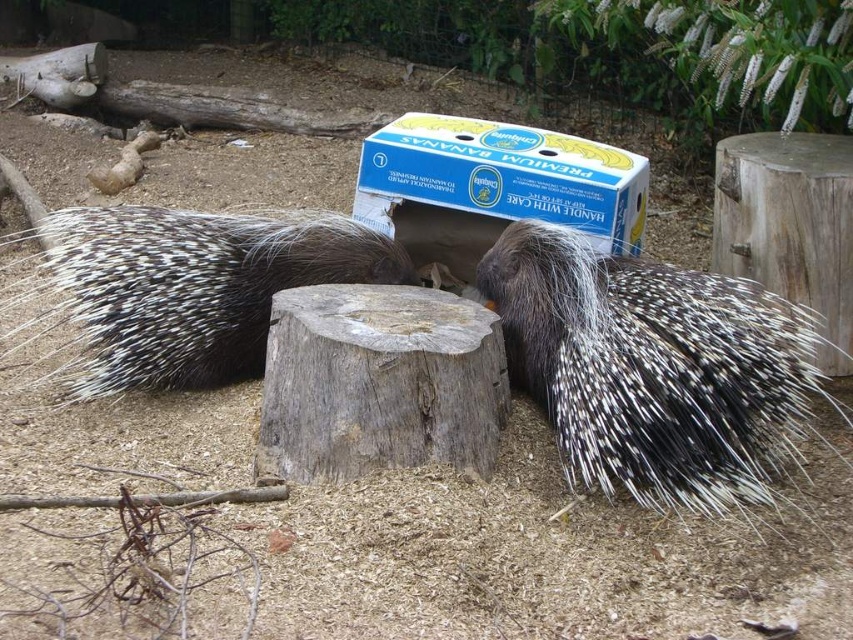
Question: Does spiny brown hedgehog at center appear over blue cardboard box at center?

Choices:
 (A) yes
 (B) no

Answer: (B)

Question: Can you confirm if spiny black hedgehog at center is positioned to the left of spiny brown hedgehog at center?

Choices:
 (A) yes
 (B) no

Answer: (B)

Question: Which of the following is the closest to the observer?

Choices:
 (A) (700, 275)
 (B) (457, 179)
 (C) (183, 339)

Answer: (A)

Question: Estimate the real-world distances between objects in this image. Which object is farther from the blue cardboard box at center?

Choices:
 (A) spiny black hedgehog at center
 (B) spiny brown hedgehog at center

Answer: (B)

Question: Is spiny brown hedgehog at center further to the viewer compared to blue cardboard box at center?

Choices:
 (A) no
 (B) yes

Answer: (A)

Question: Which of these objects is positioned closest to the blue cardboard box at center?

Choices:
 (A) spiny brown hedgehog at center
 (B) spiny black hedgehog at center

Answer: (B)